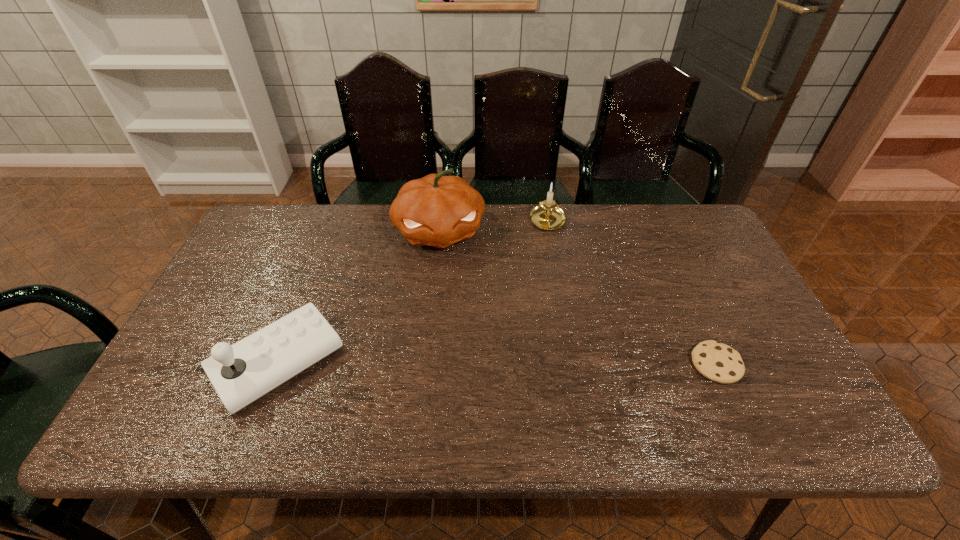
Locate an element on the screen. vacant space positioned on the front face of the third object from right to left is located at coordinates (464, 349).

Image resolution: width=960 pixels, height=540 pixels. I want to click on blank space located on the handle side of the candle holder, so click(552, 322).

You are a GUI agent. You are given a task and a screenshot of the screen. Output one action in this format:
    pyautogui.click(x=<x>, y=<y>)
    Task: Click on the free space located 0.310m on the handle side of the candle holder
    
    Given the screenshot: What is the action you would take?
    pyautogui.click(x=552, y=310)

You are a GUI agent. You are given a task and a screenshot of the screen. Output one action in this format:
    pyautogui.click(x=<x>, y=<y>)
    Task: Click on the free region located 0.290m on the handle side of the candle holder
    
    Given the screenshot: What is the action you would take?
    pyautogui.click(x=552, y=305)

At what (x,y) coordinates should I click in order to perform the action: click on pumpkin present at the far edge. Please return your answer as a coordinate pair (x, y). The width and height of the screenshot is (960, 540). Looking at the image, I should click on (437, 210).

The height and width of the screenshot is (540, 960). Find the location of `candle holder situated at the far edge`. candle holder situated at the far edge is located at coordinates (547, 215).

Where is `joystick present at the near edge`? joystick present at the near edge is located at coordinates (241, 373).

Identify the location of cookie present at the near edge. (718, 362).

Where is `object located at the left edge`? This screenshot has width=960, height=540. object located at the left edge is located at coordinates (241, 373).

The width and height of the screenshot is (960, 540). I want to click on object present at the right edge, so click(x=718, y=362).